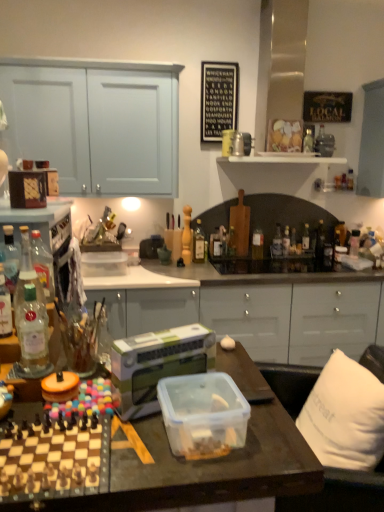
Locate an element on the screen. This screenshot has width=384, height=512. free location in front of translucent glass bottle at center, the seventh bottle when ordered from front to back is located at coordinates (241, 268).